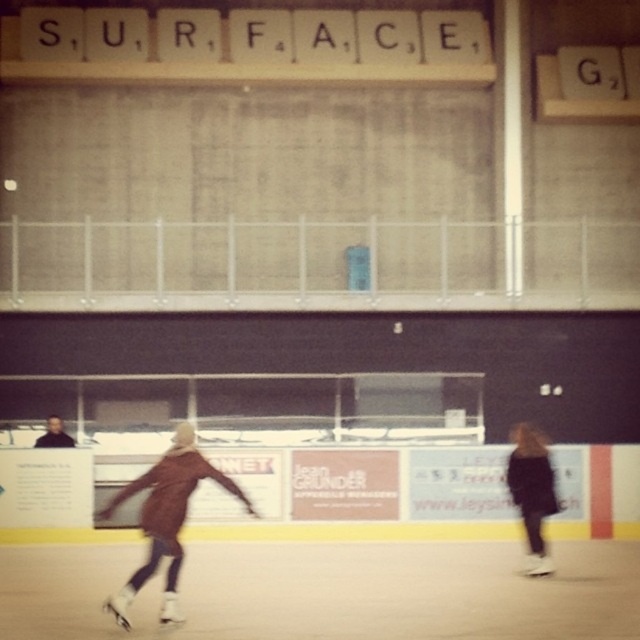
Question: Considering the relative positions of brown matte jacket at lower left and dark brown leather jacket at lower right in the image provided, where is brown matte jacket at lower left located with respect to dark brown leather jacket at lower right?

Choices:
 (A) right
 (B) left

Answer: (B)

Question: Is brown matte jacket at lower left thinner than dark brown leather jacket at lower right?

Choices:
 (A) no
 (B) yes

Answer: (A)

Question: Does brown matte jacket at lower left come behind dark brown leather jacket at lower right?

Choices:
 (A) yes
 (B) no

Answer: (B)

Question: Which point is closer to the camera?

Choices:
 (A) brown matte jacket at lower left
 (B) dark brown leather jacket at lower right

Answer: (A)